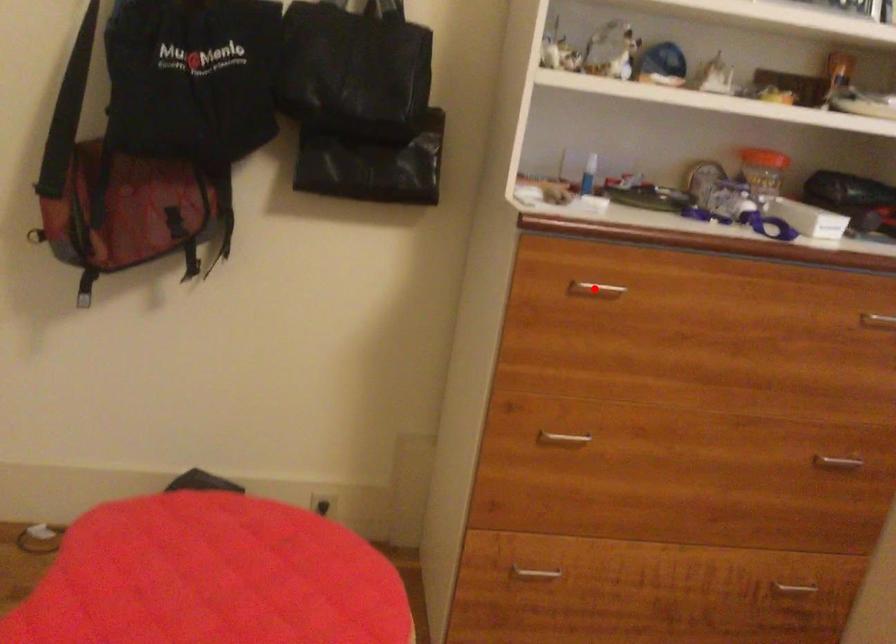
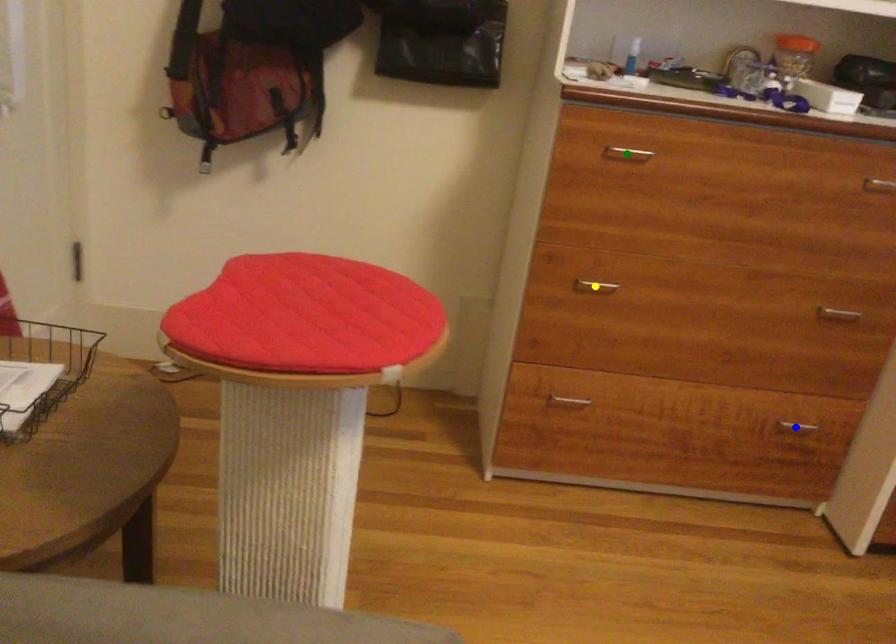
Question: I am providing you with two images of the same scene from different viewpoints. A red point is marked on the first image. You are given multiple points on the second image. Which point in image 2 represents the same 3d spot as the red point in image 1?

Choices:
 (A) green point
 (B) yellow point
 (C) blue point

Answer: (A)